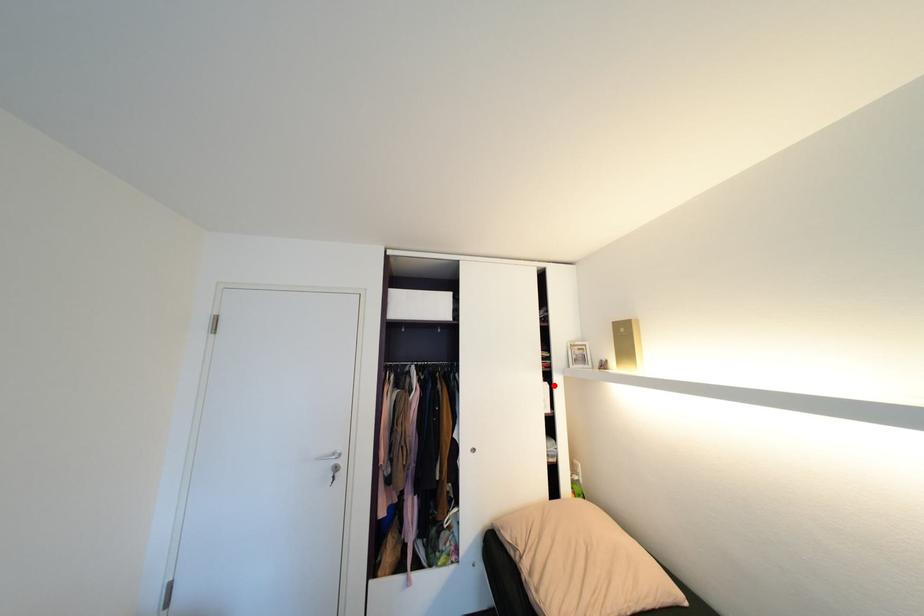
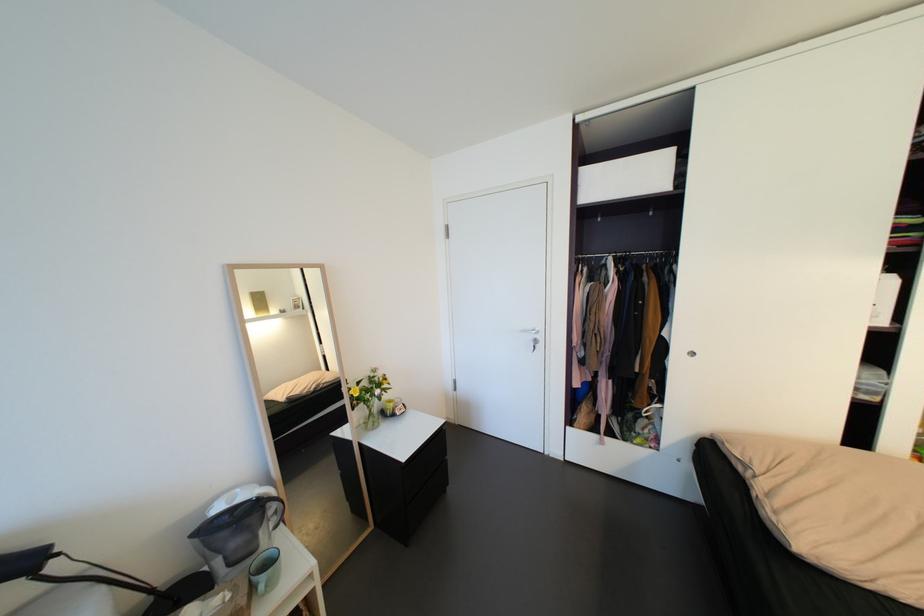
Find the pixel in the second image that matches the highlighted location in the first image.

(900, 278)